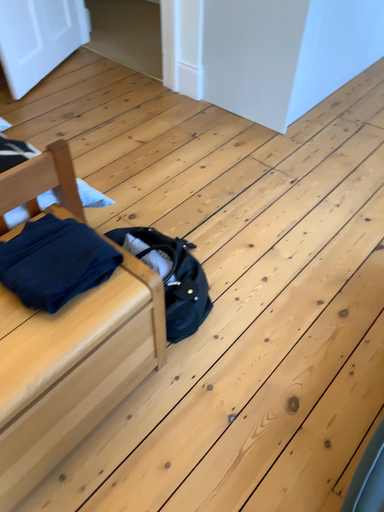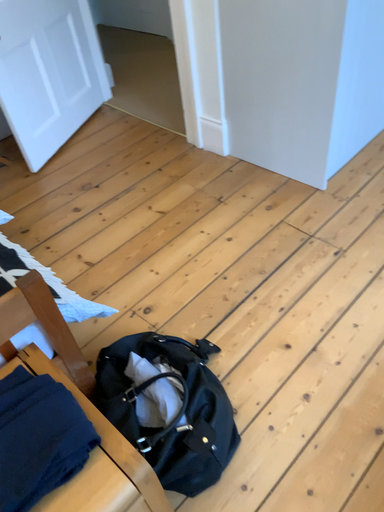
Question: How did the camera likely rotate when shooting the video?

Choices:
 (A) rotated right
 (B) rotated left

Answer: (B)